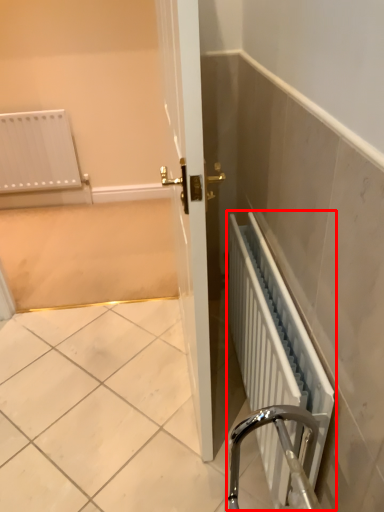
Question: From the image's perspective, where is radiator (annotated by the red box) located in relation to screen door in the image?

Choices:
 (A) below
 (B) above

Answer: (A)